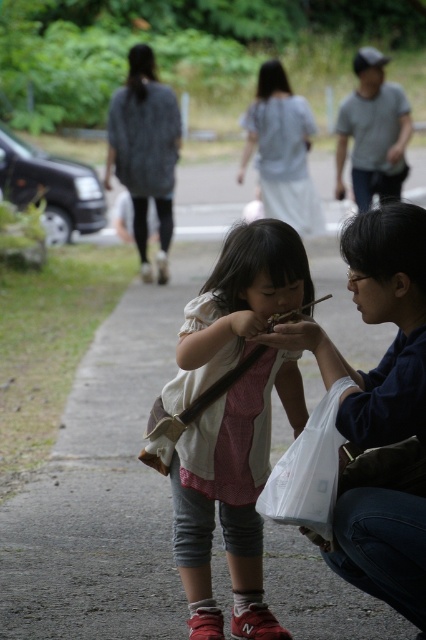
Question: Which of the following is the closest to the observer?

Choices:
 (A) light gray cotton shirt at center
 (B) gray textured sweater at upper left
 (C) white cotton shirt at center

Answer: (C)

Question: Does white cotton shirt at center come behind gray textured sweater at upper left?

Choices:
 (A) no
 (B) yes

Answer: (A)

Question: Is white cotton shirt at center above gray textured sweater at upper left?

Choices:
 (A) yes
 (B) no

Answer: (B)

Question: Is gray textured sweater at upper left above light gray cotton shirt at center?

Choices:
 (A) yes
 (B) no

Answer: (B)

Question: Which point is closer to the camera taking this photo?

Choices:
 (A) (195, 586)
 (B) (115, 154)

Answer: (A)

Question: Which point appears closest to the camera in this image?

Choices:
 (A) (342, 170)
 (B) (396, 298)
 (C) (276, 472)
 (D) (198, 618)

Answer: (B)